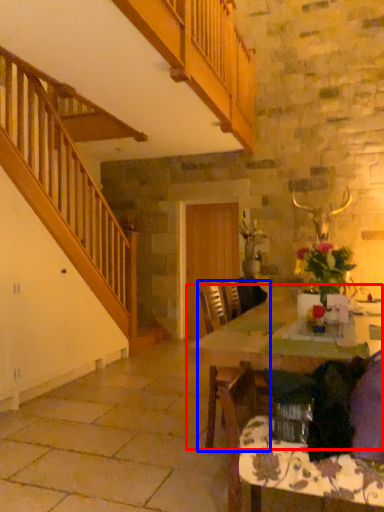
Question: Which of the following is the farthest to the observer, table (highlighted by a red box) or chair (highlighted by a blue box)?

Choices:
 (A) table
 (B) chair

Answer: (B)